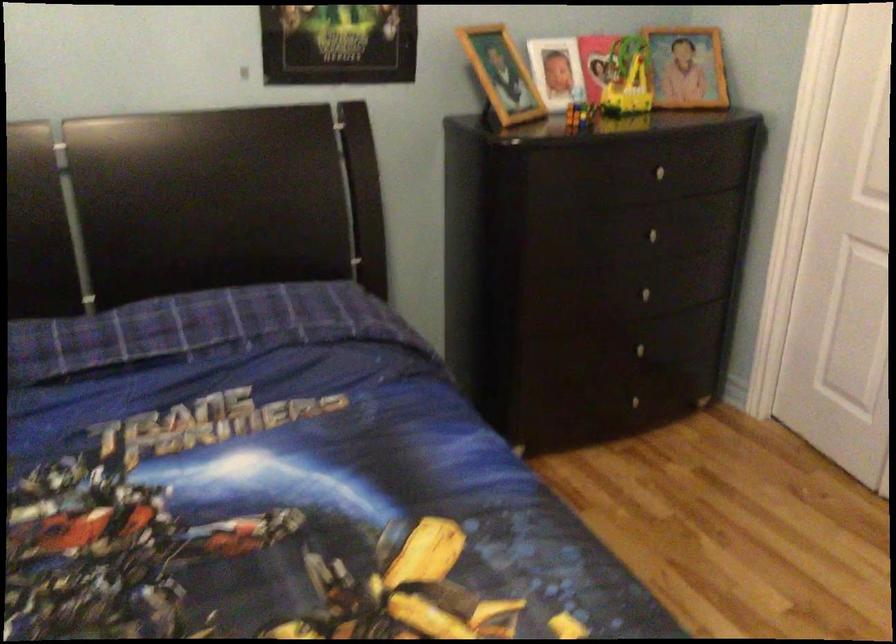
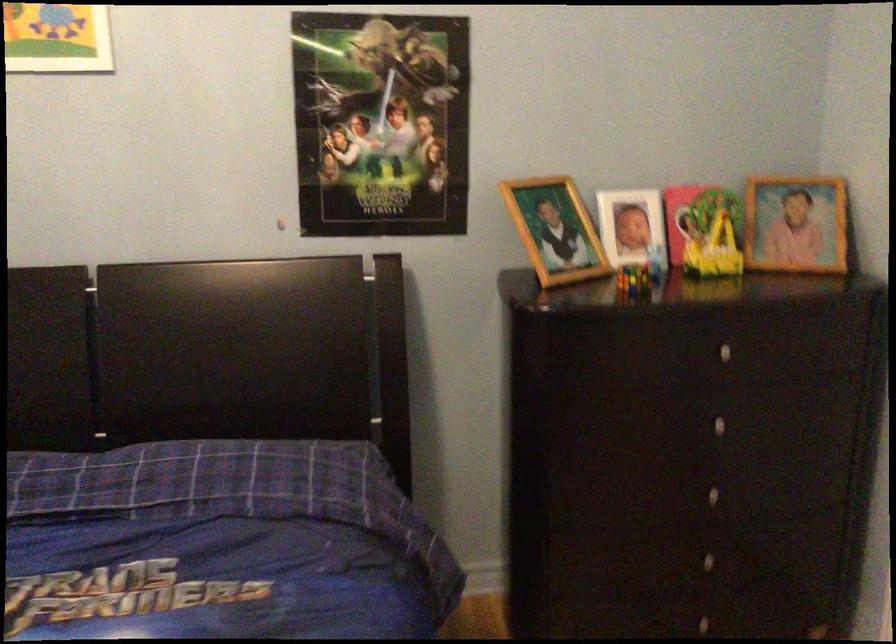
The point at (685, 67) is marked in the first image. Where is the corresponding point in the second image?

(796, 223)